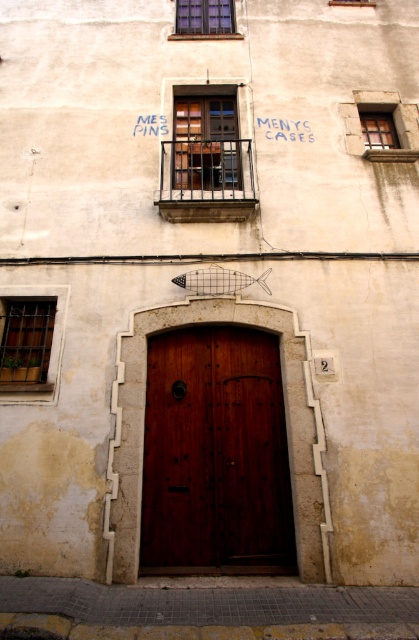
You are a window installer assessing the building facade. You need to replace the taller window between the blue glass window at upper center and the clear glass window at upper center. Which window should you replace?

The blue glass window at upper center is taller than the clear glass window at upper center, so you should replace the blue glass window at upper center.

You are standing in front of the building and want to hang a new sign. The current blue painted text at upper center is already there. Can you place a sign wider than the matte metal window at upper center above the door without overlapping the blue text?

The matte metal window at upper center is wider than the blue painted text at upper center. Since the blue text is narrower, placing a sign wider than the window would require more space than available, so it would overlap the blue text.